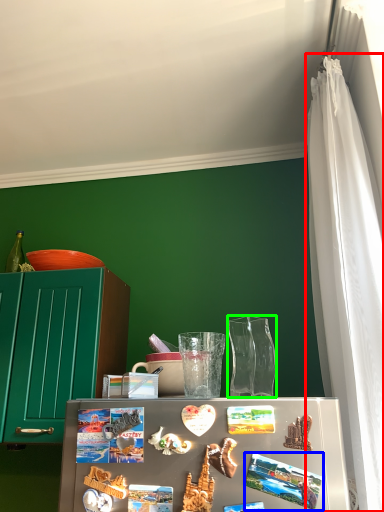
Question: Which object is positioned closest to curtain (highlighted by a red box)? Select from magnet (highlighted by a blue box) and glass vase (highlighted by a green box).

Choices:
 (A) magnet
 (B) glass vase

Answer: (B)